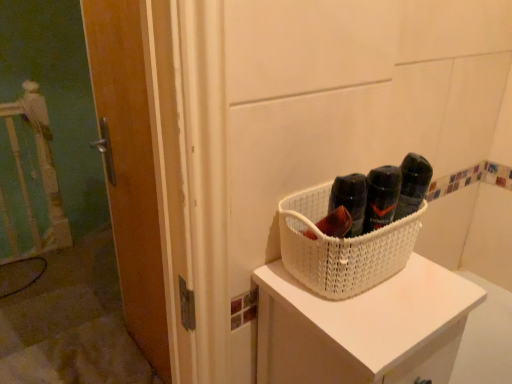
Identify the location of wooden door at left. This screenshot has width=512, height=384. (129, 169).

Measure the distance between point (332, 340) and camera.

A distance of 23.11 inches exists between point (332, 340) and camera.

Image resolution: width=512 pixels, height=384 pixels. Find the location of `white woven basket at center`. white woven basket at center is located at coordinates (341, 247).

From the image's perspective, is white woven basket at center located above white woven basket at upper right?

Indeed, from the image's perspective, white woven basket at center is shown above white woven basket at upper right.

From a real-world perspective, is white woven basket at center over white woven basket at upper right?

Yes, from a real-world perspective, white woven basket at center is on top of white woven basket at upper right.

Between white woven basket at center and white woven basket at upper right, which one is positioned in front?

white woven basket at upper right is in front.

Based on the photo, what's the angular difference between white woven basket at center and white woven basket at upper right's facing directions?

0.921 degrees separate the facing orientations of white woven basket at center and white woven basket at upper right.

Considering the relative sizes of white woven basket at upper right and white woven basket at center in the image provided, is white woven basket at upper right shorter than white woven basket at center?

In fact, white woven basket at upper right may be taller than white woven basket at center.

Which is behind, point (313, 304) or point (406, 253)?

Point (406, 253)

Is white woven basket at upper right completely or partially outside of white woven basket at center?

Indeed, white woven basket at upper right is completely outside white woven basket at center.

Which point is more distant from viewer, (x=449, y=362) or (x=94, y=37)?

The point (x=94, y=37) is farther.

From the image's perspective, between white woven basket at upper right and wooden door at left, who is located below?

From the image's view, white woven basket at upper right is below.

Can you confirm if white woven basket at upper right is smaller than wooden door at left?

Incorrect, white woven basket at upper right is not smaller in size than wooden door at left.

Is white woven basket at upper right turned away from wooden door at left?

Absolutely, white woven basket at upper right is directed away from wooden door at left.

Consider the image. Can you confirm if wooden door at left is taller than white woven basket at upper right?

Indeed, wooden door at left has a greater height compared to white woven basket at upper right.

Locate an element on the screen. furniture below the wooden door at left (from the image's perspective) is located at coordinates (362, 328).

Is wooden door at left positioned far away from white woven basket at upper right?

No, wooden door at left is in close proximity to white woven basket at upper right.

Is wooden door at left next to white woven basket at center and touching it?

They are not placed beside each other.

Considering their positions, is wooden door at left located in front of or behind white woven basket at center?

wooden door at left is positioned farther from the viewer than white woven basket at center.

Between wooden door at left and white woven basket at center, which one has larger width?

With larger width is white woven basket at center.

Is wooden door at left shorter than white woven basket at center?

In fact, wooden door at left may be taller than white woven basket at center.

Considering the relative positions of white woven basket at center and wooden door at left in the image provided, is white woven basket at center to the left or to the right of wooden door at left?

Based on their positions, white woven basket at center is located to the right of wooden door at left.

Locate an element on the screen. This screenshot has height=384, width=512. basket lying in front of the wooden door at left is located at coordinates (341, 247).

From a real-world perspective, which object rests below the other?

wooden door at left, from a real-world perspective.

Could you tell me if white woven basket at center is facing wooden door at left?

No, white woven basket at center is not aimed at wooden door at left.

Locate an element on the screen. The width and height of the screenshot is (512, 384). furniture that appears on the right of white woven basket at center is located at coordinates (362, 328).

At what (x,y) coordinates should I click in order to perform the action: click on basket behind the white woven basket at upper right. Please return your answer as a coordinate pair (x, y). This screenshot has width=512, height=384. Looking at the image, I should click on (341, 247).

Looking at the image, which one is located further to white woven basket at center, wooden door at left or white woven basket at upper right?

wooden door at left is further to white woven basket at center.

From the image, which object appears to be farther from wooden door at left, white woven basket at center or white woven basket at upper right?

white woven basket at center is positioned further to the anchor wooden door at left.

Estimate the real-world distances between objects in this image. Which object is further from white woven basket at upper right, wooden door at left or white woven basket at center?

wooden door at left.

Looking at the image, which one is located further to white woven basket at upper right, white woven basket at center or wooden door at left?

wooden door at left is further to white woven basket at upper right.

When comparing their distances from wooden door at left, does white woven basket at upper right or white woven basket at center seem closer?

white woven basket at upper right is closer to wooden door at left.

From the image, which object appears to be farther from white woven basket at center, white woven basket at upper right or wooden door at left?

wooden door at left is positioned further to the anchor white woven basket at center.

The image size is (512, 384). I want to click on basket situated between wooden door at left and white woven basket at upper right from left to right, so click(x=341, y=247).